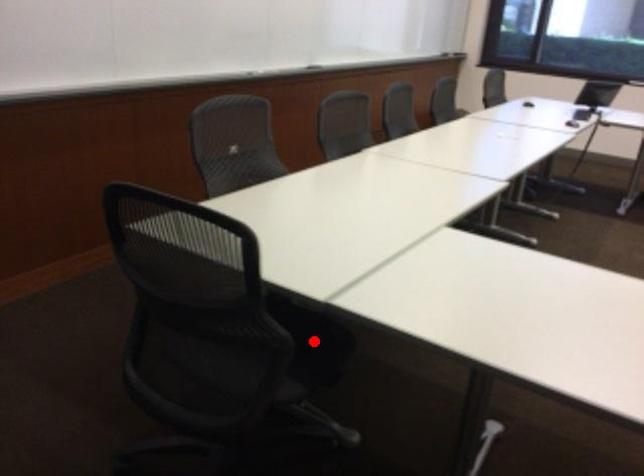
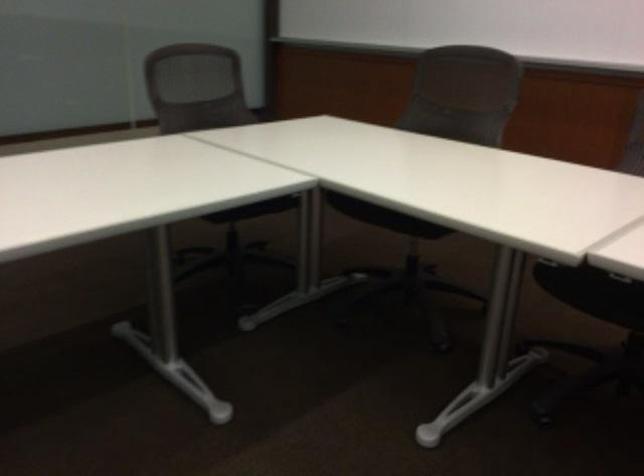
Question: I am providing you with two images of the same scene from different viewpoints. A red point is marked on the first image. Can you still see the location of the red point in image 2?

Choices:
 (A) Yes
 (B) No

Answer: (B)